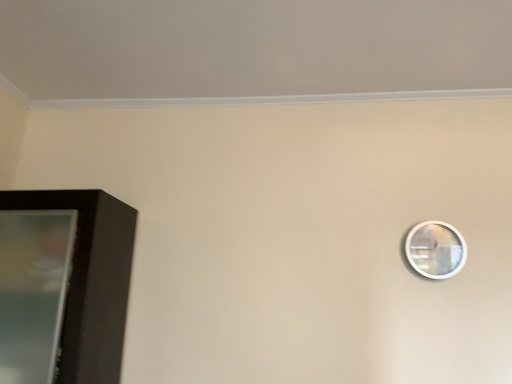
Question: Is black glossy cabinet at left situated inside silver metallic mirror at upper right or outside?

Choices:
 (A) outside
 (B) inside

Answer: (A)

Question: Is black glossy cabinet at left wider or thinner than silver metallic mirror at upper right?

Choices:
 (A) wide
 (B) thin

Answer: (A)

Question: Would you say black glossy cabinet at left is to the left or to the right of silver metallic mirror at upper right in the picture?

Choices:
 (A) left
 (B) right

Answer: (A)

Question: Based on their positions, is silver metallic mirror at upper right located to the left or right of black glossy cabinet at left?

Choices:
 (A) right
 (B) left

Answer: (A)

Question: Would you say silver metallic mirror at upper right is inside or outside black glossy cabinet at left?

Choices:
 (A) inside
 (B) outside

Answer: (B)

Question: In terms of height, does silver metallic mirror at upper right look taller or shorter compared to black glossy cabinet at left?

Choices:
 (A) short
 (B) tall

Answer: (A)

Question: From the image's perspective, relative to black glossy cabinet at left, is silver metallic mirror at upper right above or below?

Choices:
 (A) above
 (B) below

Answer: (A)